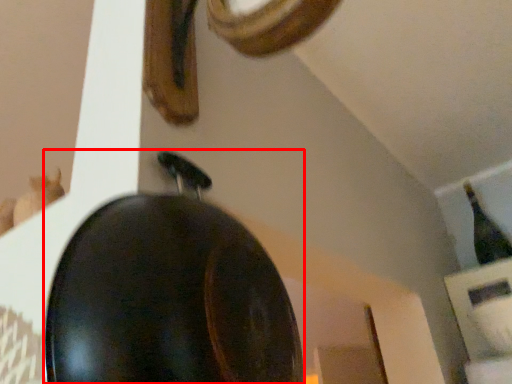
Question: Observing the image, what is the correct spatial positioning of frying pan (annotated by the red box) in reference to bottle?

Choices:
 (A) left
 (B) right

Answer: (A)